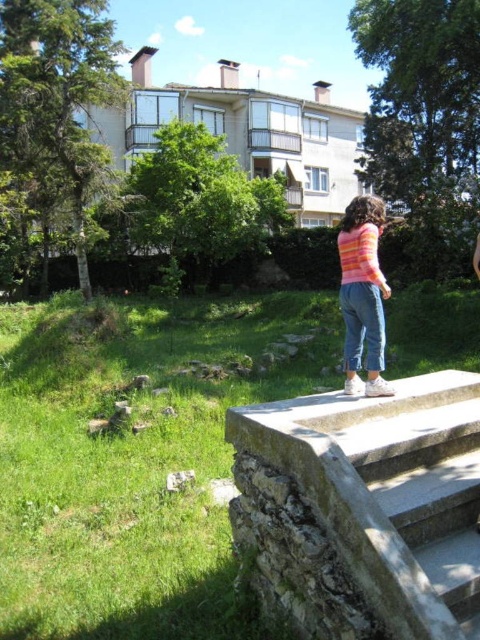
Question: Is stone stairs at center behind pink striped sweater at center?

Choices:
 (A) yes
 (B) no

Answer: (B)

Question: Which of the following is the closest to the observer?

Choices:
 (A) stone stairs at center
 (B) pink striped sweater at center

Answer: (A)

Question: Which of the following is the farthest from the observer?

Choices:
 (A) (396, 566)
 (B) (367, 323)

Answer: (B)

Question: Is stone stairs at center above pink striped sweater at center?

Choices:
 (A) yes
 (B) no

Answer: (B)

Question: Is stone stairs at center further to camera compared to pink striped sweater at center?

Choices:
 (A) yes
 (B) no

Answer: (B)